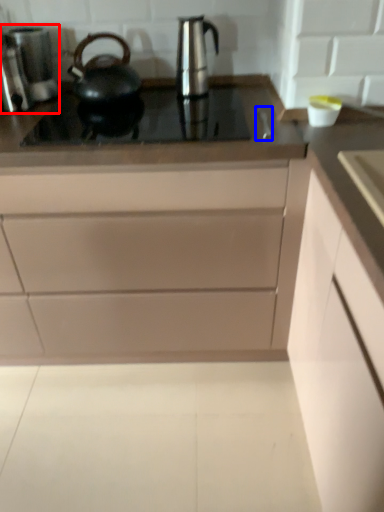
Question: Which point is closer to the camera, coffee machine (highlighted by a red box) or faucet (highlighted by a blue box)?

Choices:
 (A) coffee machine
 (B) faucet

Answer: (B)